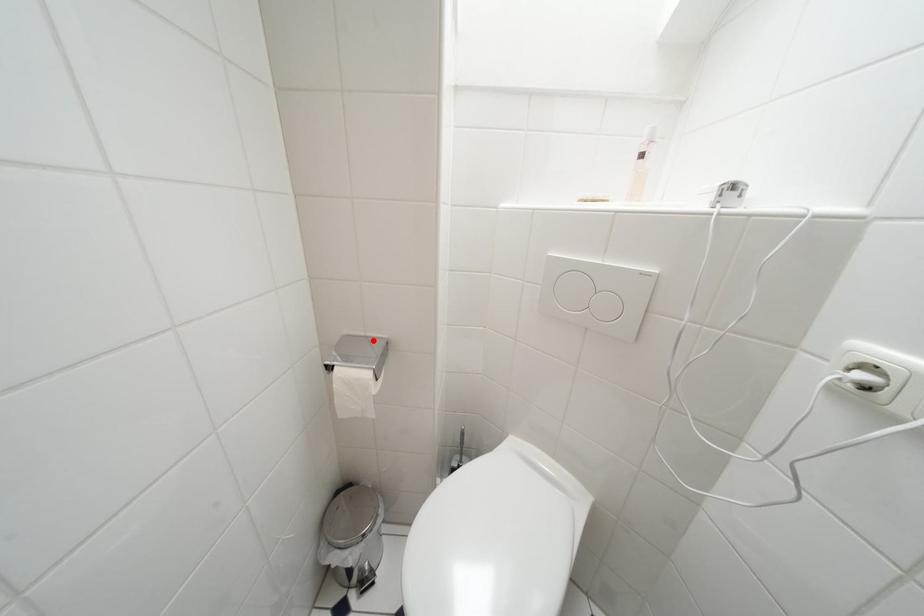
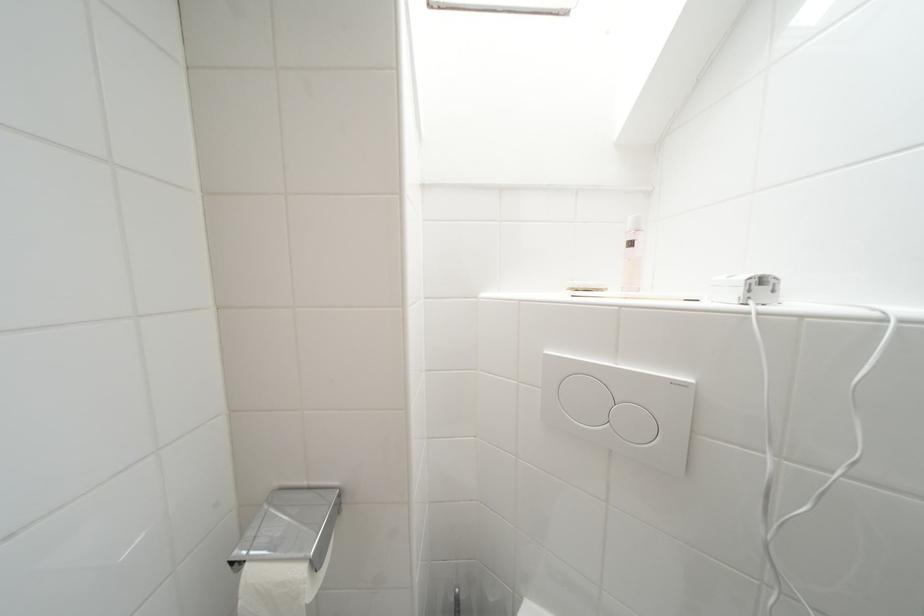
In the second image, find the point that corresponds to the highlighted location in the first image.

(315, 491)